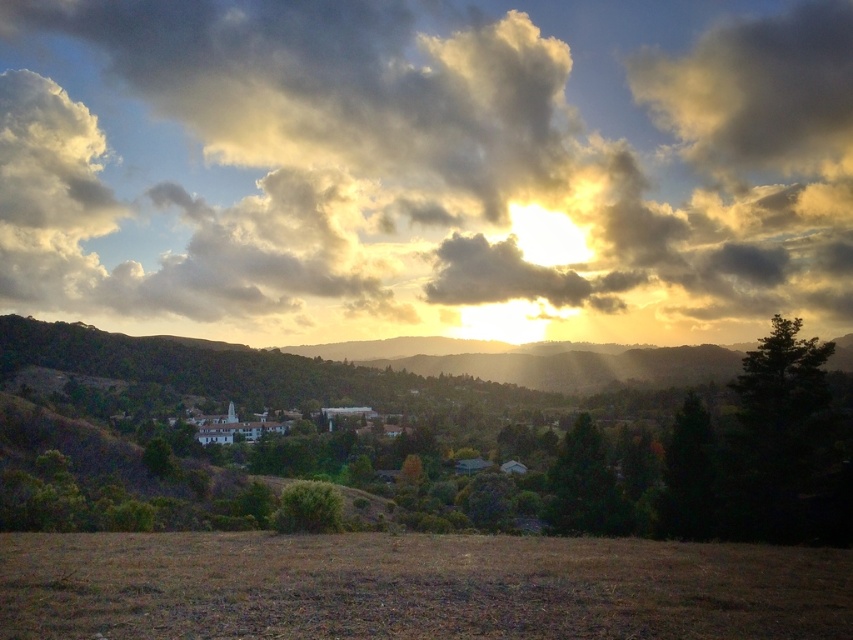
Question: Which of these objects is positioned farthest from the green matte tree at center?

Choices:
 (A) green matte tree at right
 (B) dark green leafy tree at right
 (C) brown grass at lower center
 (D) green leafy bush at center

Answer: (C)

Question: Which object is the farthest from the green matte tree at right?

Choices:
 (A) green leafy bush at center
 (B) green leafy tree at center
 (C) green matte tree at center

Answer: (B)

Question: Can you confirm if green leafy tree at center is smaller than green matte tree at center?

Choices:
 (A) no
 (B) yes

Answer: (A)

Question: Does cloudy sky at upper center have a smaller size compared to brown grass at lower center?

Choices:
 (A) yes
 (B) no

Answer: (B)

Question: Considering the real-world distances, which object is closest to the green leafy bush at center?

Choices:
 (A) dark green leafy tree at right
 (B) green matte tree at center
 (C) brown grass at lower center
 (D) green leafy tree at center

Answer: (C)

Question: Can you confirm if green matte tree at right is positioned above green matte tree at center?

Choices:
 (A) yes
 (B) no

Answer: (A)